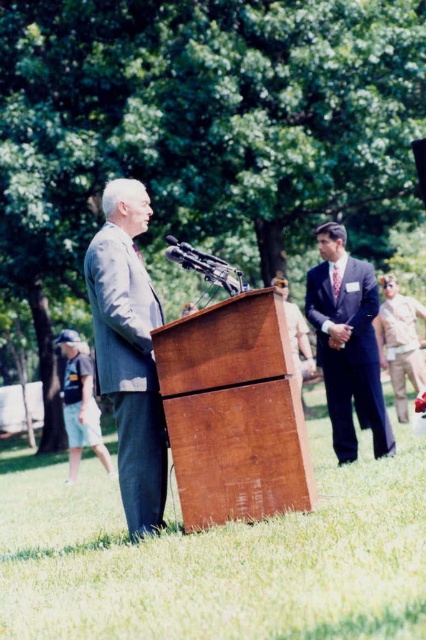
In the scene shown: Measure the distance from brown wood podium at center to gray suit at center.

19.43 inches

Does brown wood podium at center lie in front of gray suit at center?

Yes, it is.

Locate an element on the screen. The height and width of the screenshot is (640, 426). brown wood podium at center is located at coordinates (233, 412).

Is point (129, 477) positioned in front of point (339, 278)?

Yes, it is.

Is the position of gray suit at center more distant than that of dark gray suit at right?

That is False.

Between point (120, 298) and point (336, 440), which one is positioned behind?

Positioned behind is point (336, 440).

I want to click on gray suit at center, so click(x=129, y=349).

Who is shorter, brown wood podium at center or dark gray suit at right?

With less height is brown wood podium at center.

Is brown wood podium at center below dark gray suit at right?

Correct, brown wood podium at center is located below dark gray suit at right.

Between point (270, 477) and point (365, 419), which one is positioned behind?

Point (365, 419)

The image size is (426, 640). Identify the location of brown wood podium at center. (233, 412).